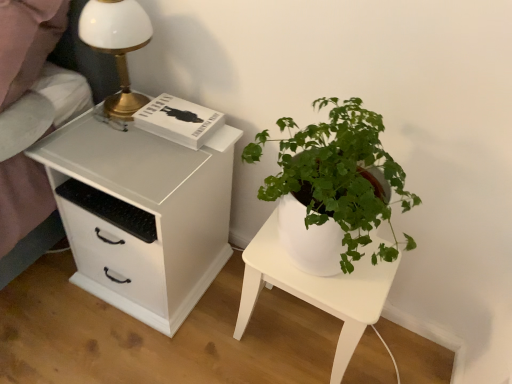
Question: Does white glossy table lamp at upper left have a greater width compared to white matte chest of drawers at left?

Choices:
 (A) yes
 (B) no

Answer: (B)

Question: Could you tell me if white glossy table lamp at upper left is facing white matte chest of drawers at left?

Choices:
 (A) yes
 (B) no

Answer: (B)

Question: Is white glossy table lamp at upper left at the right side of white matte chest of drawers at left?

Choices:
 (A) yes
 (B) no

Answer: (B)

Question: From the image's perspective, is white glossy table lamp at upper left on top of white matte chest of drawers at left?

Choices:
 (A) no
 (B) yes

Answer: (B)

Question: Does white glossy table lamp at upper left come behind white matte chest of drawers at left?

Choices:
 (A) yes
 (B) no

Answer: (A)

Question: From a real-world perspective, does white glossy table lamp at upper left sit lower than white matte chest of drawers at left?

Choices:
 (A) yes
 (B) no

Answer: (B)

Question: Does white glossy table lamp at upper left have a greater width compared to white glossy nightstand at lower right?

Choices:
 (A) no
 (B) yes

Answer: (A)

Question: Does white glossy table lamp at upper left lie in front of white glossy nightstand at lower right?

Choices:
 (A) no
 (B) yes

Answer: (B)

Question: Would you say white glossy table lamp at upper left is a long distance from white glossy nightstand at lower right?

Choices:
 (A) no
 (B) yes

Answer: (A)

Question: Is white glossy table lamp at upper left thinner than white glossy nightstand at lower right?

Choices:
 (A) yes
 (B) no

Answer: (A)

Question: Is white glossy table lamp at upper left taller than white glossy nightstand at lower right?

Choices:
 (A) yes
 (B) no

Answer: (B)

Question: From the image's perspective, does white glossy table lamp at upper left appear higher than white glossy nightstand at lower right?

Choices:
 (A) no
 (B) yes

Answer: (B)

Question: Would you say white glossy table lamp at upper left is part of white matte chest of drawers at left's contents?

Choices:
 (A) yes
 (B) no

Answer: (B)